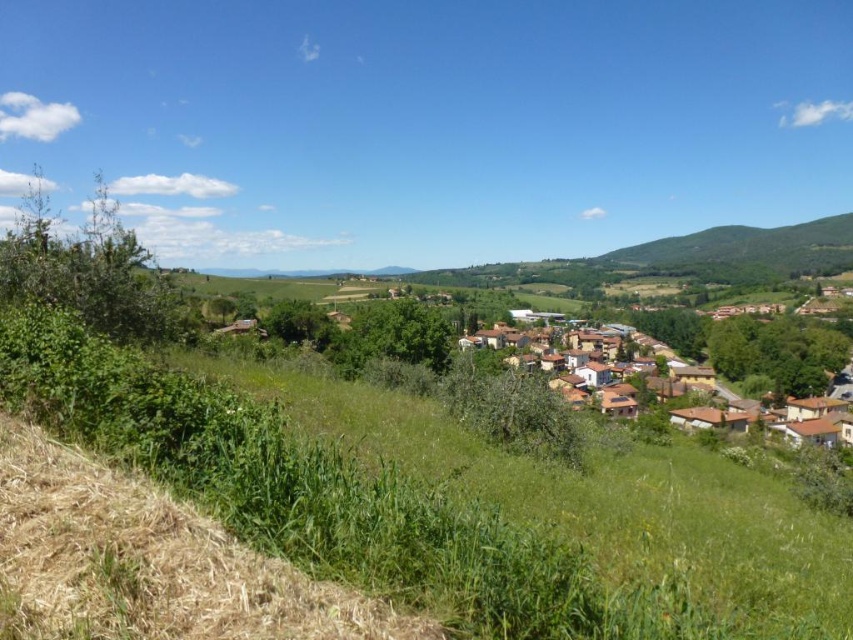
Is green grassy hillside at lower left closer to the viewer compared to green grassy hillside at right?

Yes.

Does point (509, 481) come in front of point (804, 228)?

Yes.

In order to click on green grassy hillside at lower left in this screenshot , I will do `click(601, 499)`.

Is green grassy hillside at lower left above brown tiled roofs at center?

Indeed, green grassy hillside at lower left is positioned over brown tiled roofs at center.

Does green grassy hillside at lower left appear on the left side of brown tiled roofs at center?

Indeed, green grassy hillside at lower left is positioned on the left side of brown tiled roofs at center.

Who is more forward, (447, 419) or (811, 356)?

Positioned in front is point (447, 419).

What are the coordinates of `green grassy hillside at lower left` in the screenshot? It's located at (601, 499).

Can you confirm if green grassy hillside at lower left is positioned below brown dry grass at lower left?

Correct, green grassy hillside at lower left is located below brown dry grass at lower left.

From the picture: Can you confirm if green grassy hillside at lower left is thinner than brown dry grass at lower left?

No, green grassy hillside at lower left is not thinner than brown dry grass at lower left.

You are a GUI agent. You are given a task and a screenshot of the screen. Output one action in this format:
    pyautogui.click(x=<x>, y=<y>)
    Task: Click on the green grassy hillside at lower left
    The width and height of the screenshot is (853, 640).
    Given the screenshot: What is the action you would take?
    pyautogui.click(x=601, y=499)